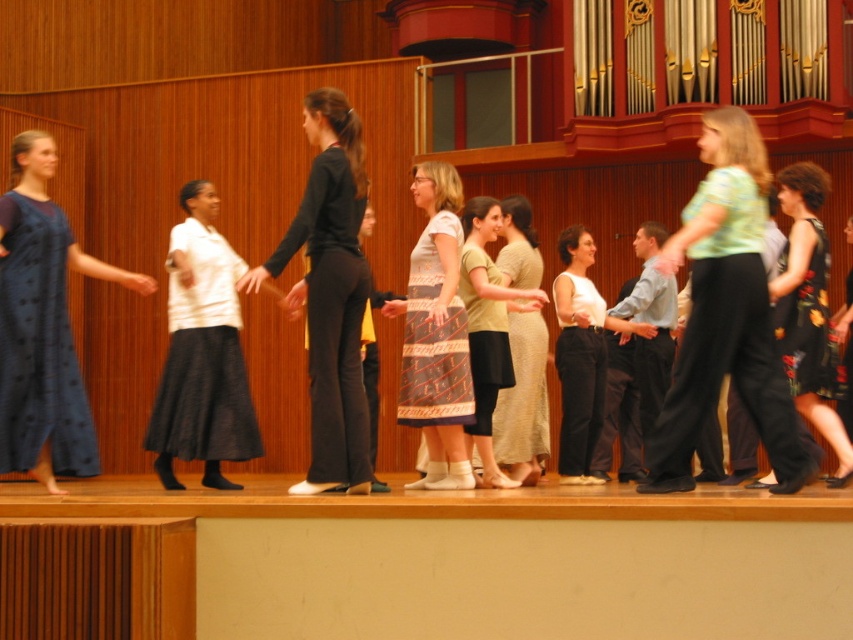
You are a photographer positioned at the back of the stage. You want to capture a photo that includes both the black smooth pants at center and the light beige linen dress at center. Given that your camera has a maximum focus range of 8 feet, will you be able to include both subjects in the same frame without moving closer?

The black smooth pants at center and light beige linen dress at center are 8.66 feet apart. Since the distance between them exceeds the camera maximum focus range of 8 feet, you will not be able to include both subjects in the same frame without moving closer.

You are a photographer positioned at the back of the stage. You need to capture a clear photo of both the black smooth pants at center and the light beige linen dress at center. Which one will appear taller in your photo?

The black smooth pants at center will appear taller in the photo because the black smooth pants at center is taller than the light beige linen dress at center according to the description.